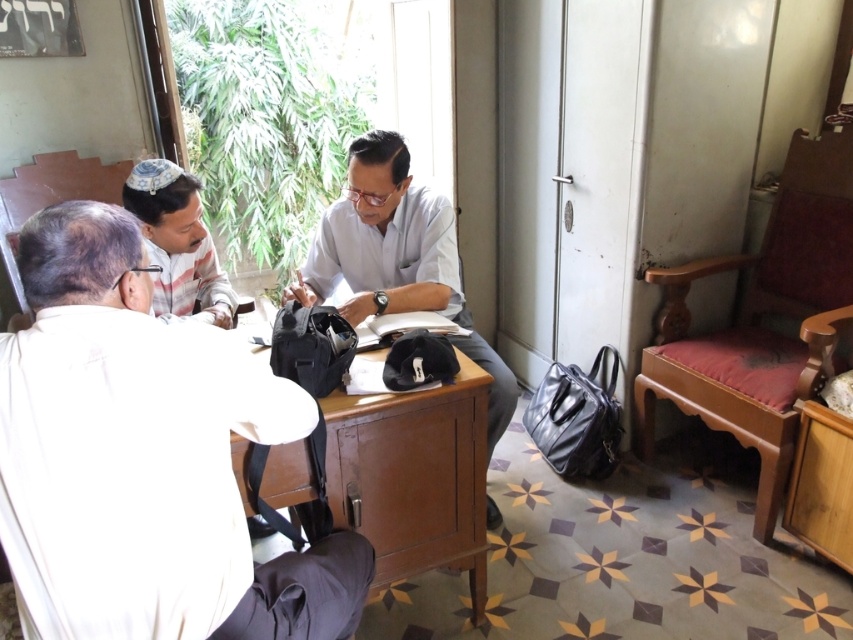
You are standing in the room and want to hand a document to the person wearing the white matte shirt at left. The wooden desk at center is blocking your path. Can you walk around the desk to reach them?

The white matte shirt at left is to the left of the wooden desk at center, so you can walk around the left side of the wooden desk at center to reach the person wearing the white matte shirt at left.

You are a delivery person trying to place a rectangular package that is 2 feet wide on the wooden desk at center. The white matte shirt at center is currently occupying part of the desk. Can the package fit on the desk without moving the shirt?

The wooden desk at center is narrower than the white matte shirt at center, which suggests the desk is too narrow to accommodate a 2 feet wide package even without considering the shirt. Therefore, the package cannot fit on the desk.